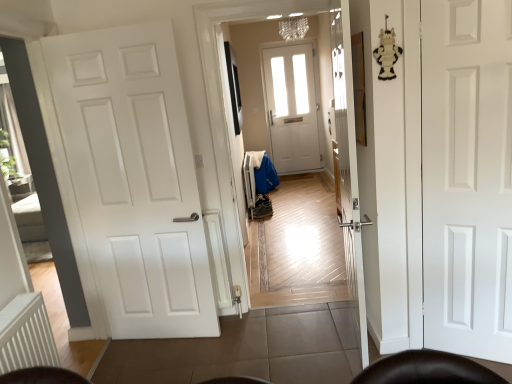
Question: Considering their positions, is white ribbed radiator at lower left located in front of or behind white matte door at left, which is the 2th door from right to left?

Choices:
 (A) front
 (B) behind

Answer: (A)

Question: From the image's perspective, relative to white matte door at left, which is the 2th door from right to left, is white ribbed radiator at lower left above or below?

Choices:
 (A) below
 (B) above

Answer: (A)

Question: Which of these objects is positioned farthest from the white ribbed radiator at lower left?

Choices:
 (A) white matte door at left, acting as the 1th door starting from the left
 (B) white matte door at right, acting as the 1th door starting from the right

Answer: (B)

Question: Estimate the real-world distances between objects in this image. Which object is farther from the white ribbed radiator at lower left?

Choices:
 (A) white matte door at right, acting as the 1th door starting from the right
 (B) white matte door at left, acting as the 1th door starting from the left

Answer: (A)